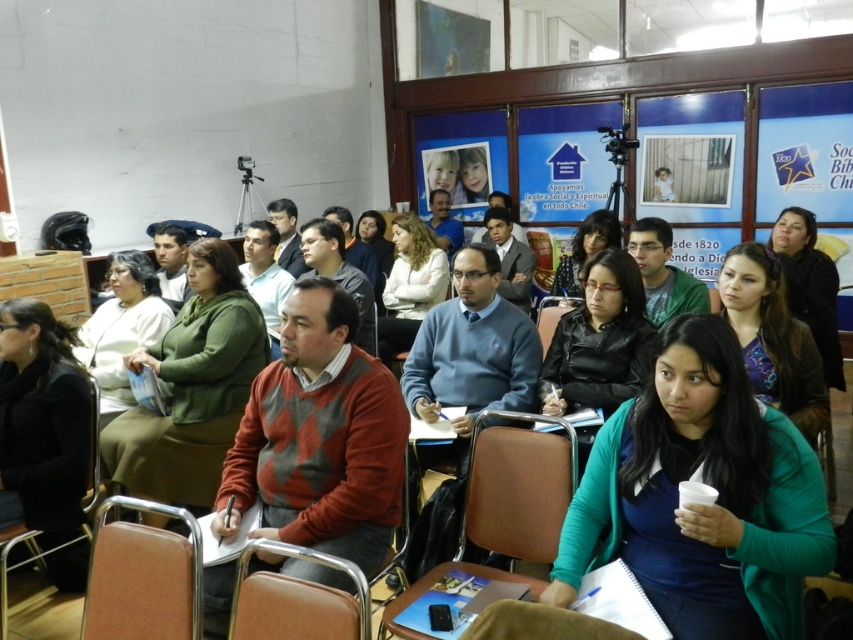
Question: Which object is closer to the camera taking this photo?

Choices:
 (A) brown leather chair at lower left
 (B) brown wood chair at center

Answer: (B)

Question: Is brown leather chair at lower left smaller than brown wood chair at center?

Choices:
 (A) yes
 (B) no

Answer: (A)

Question: Which object appears closest to the camera in this image?

Choices:
 (A) brown leather chair at lower left
 (B) brown leather chair at center
 (C) brown wood chair at center

Answer: (C)

Question: Does brown leather chair at lower left have a smaller size compared to brown wood chair at center?

Choices:
 (A) no
 (B) yes

Answer: (B)

Question: Does brown leather chair at lower left appear on the right side of brown leather chair at center?

Choices:
 (A) no
 (B) yes

Answer: (A)

Question: Which point is closer to the camera?

Choices:
 (A) (341, 621)
 (B) (544, 333)
 (C) (105, 557)

Answer: (A)